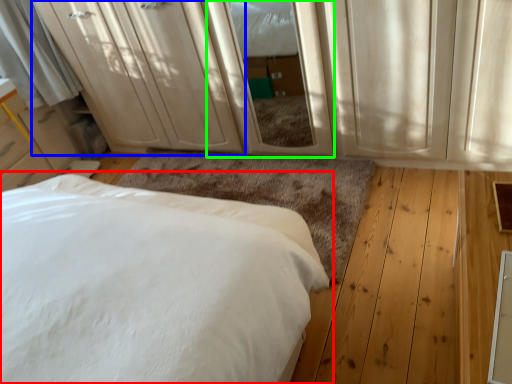
Question: Based on their relative distances, which object is nearer to bed (highlighted by a red box)? Choose from dresser (highlighted by a blue box) and screen door (highlighted by a green box).

Choices:
 (A) dresser
 (B) screen door

Answer: (B)